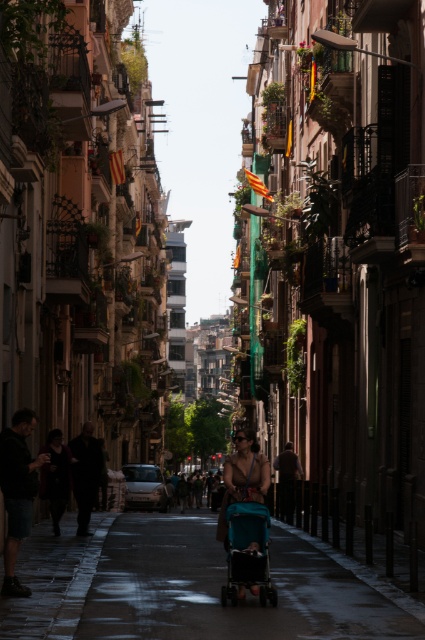
Question: Can you confirm if teal plastic stroller at center is positioned above teal fabric stroller at center?

Choices:
 (A) yes
 (B) no

Answer: (B)

Question: Which of the following is the farthest from the observer?

Choices:
 (A) teal fabric stroller at center
 (B) teal plastic stroller at center

Answer: (A)

Question: Which of the following is the farthest from the observer?

Choices:
 (A) (149, 611)
 (B) (261, 515)

Answer: (B)

Question: Can you confirm if teal plastic stroller at center is positioned below teal fabric stroller at center?

Choices:
 (A) no
 (B) yes

Answer: (B)

Question: Is teal plastic stroller at center positioned at the back of teal fabric stroller at center?

Choices:
 (A) yes
 (B) no

Answer: (B)

Question: Which point appears farthest from the camera in this image?

Choices:
 (A) (6, 632)
 (B) (252, 561)

Answer: (B)